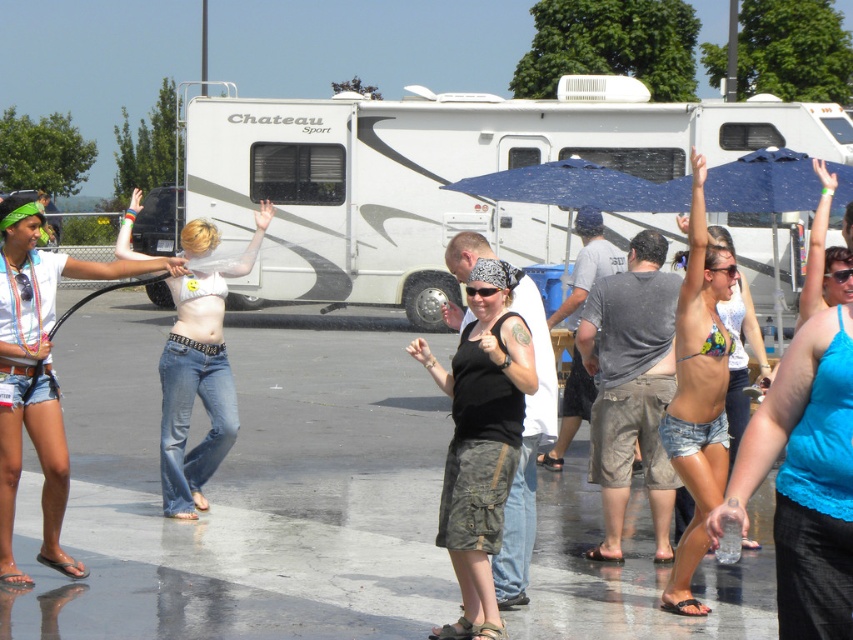
Between point (236, 125) and point (15, 269), which one is positioned in front?

Point (15, 269) is in front.

Describe the element at coordinates (442, 177) in the screenshot. I see `white glossy recreational vehicle at center` at that location.

The image size is (853, 640). I want to click on white glossy recreational vehicle at center, so click(x=442, y=177).

Does point (199, 134) come behind point (189, 403)?

Yes.

Who is positioned more to the right, white glossy recreational vehicle at center or denim jeans at center?

white glossy recreational vehicle at center

Find the location of a particular element. The height and width of the screenshot is (640, 853). white glossy recreational vehicle at center is located at coordinates (442, 177).

At what (x,y) coordinates should I click in order to perform the action: click on white glossy recreational vehicle at center. Please return your answer as a coordinate pair (x, y). The image size is (853, 640). Looking at the image, I should click on (442, 177).

Does printed bikini top at center appear on the right side of denim jeans at center?

Indeed, printed bikini top at center is positioned on the right side of denim jeans at center.

Is printed bikini top at center smaller than denim jeans at center?

Yes.

This screenshot has width=853, height=640. Describe the element at coordinates (698, 390) in the screenshot. I see `printed bikini top at center` at that location.

The height and width of the screenshot is (640, 853). Find the location of `printed bikini top at center`. printed bikini top at center is located at coordinates pyautogui.click(x=698, y=390).